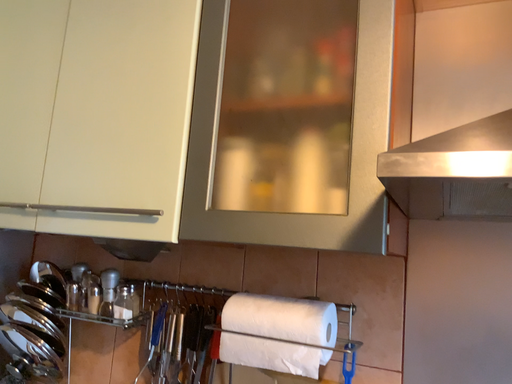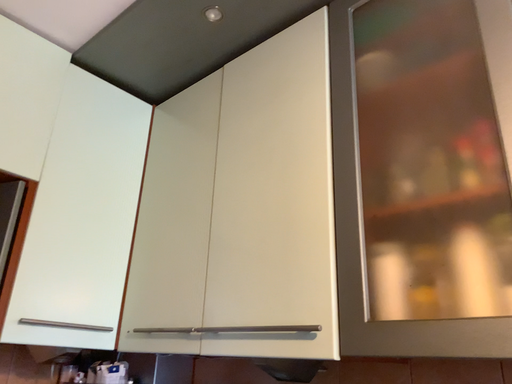
Question: Which way did the camera rotate in the video?

Choices:
 (A) rotated downward
 (B) rotated upward

Answer: (B)